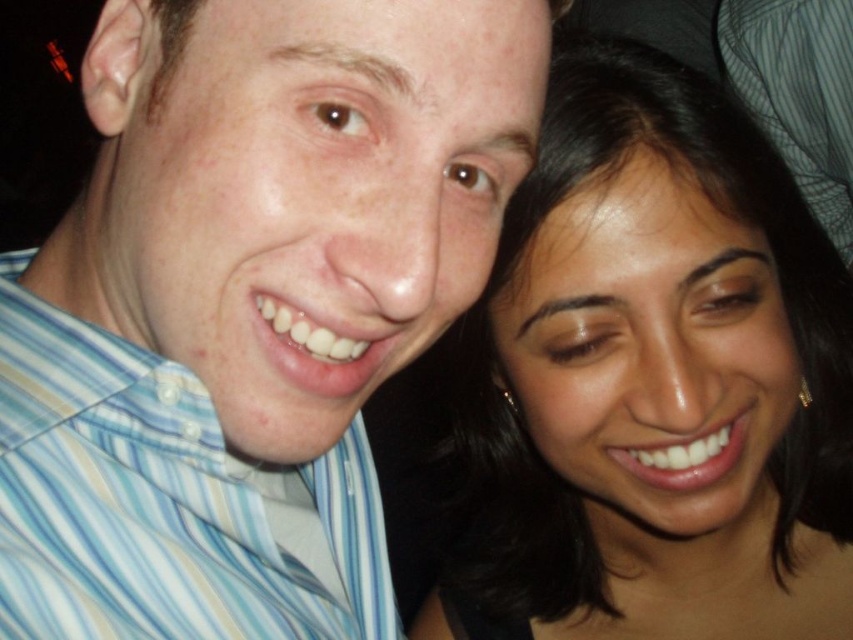
Does dark brown hair at upper right lie behind blue striped shirt at upper left?

Yes, dark brown hair at upper right is behind blue striped shirt at upper left.

Between point (817, 330) and point (212, 518), which one is positioned behind?

The point (817, 330) is behind.

Describe the element at coordinates (654, 380) in the screenshot. The image size is (853, 640). I see `dark brown hair at upper right` at that location.

Locate an element on the screen. The width and height of the screenshot is (853, 640). dark brown hair at upper right is located at coordinates (654, 380).